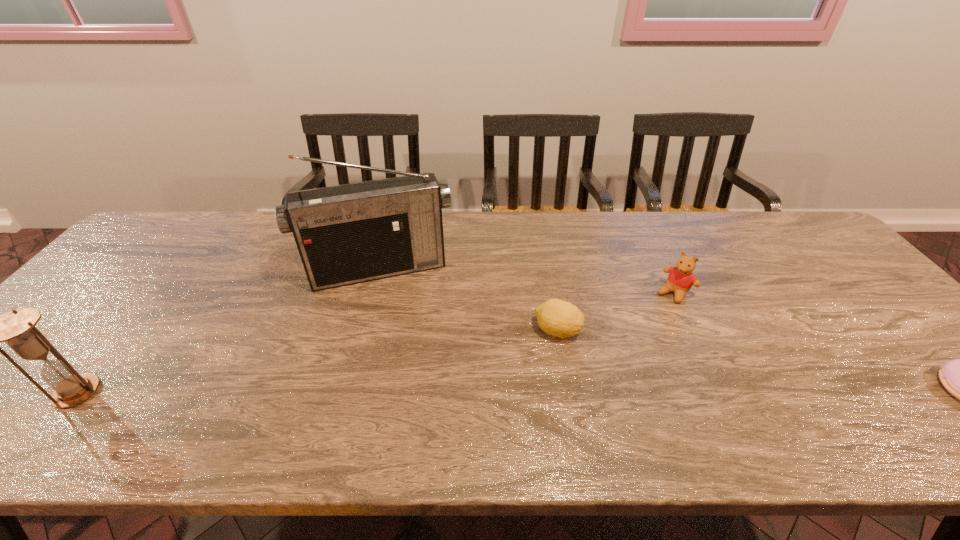
The height and width of the screenshot is (540, 960). Find the location of `the second tallest object`. the second tallest object is located at coordinates (17, 328).

What are the coordinates of `hourglass` in the screenshot? It's located at (17, 328).

Where is `teddy bear`? teddy bear is located at coordinates (680, 280).

The image size is (960, 540). What are the coordinates of `the third shortest object` in the screenshot? It's located at (680, 280).

At what (x,y) coordinates should I click in order to perform the action: click on the second shortest object. Please return your answer as a coordinate pair (x, y). The width and height of the screenshot is (960, 540). Looking at the image, I should click on (559, 318).

I want to click on the third object from left to right, so click(559, 318).

This screenshot has width=960, height=540. Identify the location of the fourth object from right to left. (346, 234).

Locate an element on the screen. the tallest object is located at coordinates (346, 234).

Where is `free space located 0.400m on the right of the second tallest object`? This screenshot has height=540, width=960. free space located 0.400m on the right of the second tallest object is located at coordinates (281, 392).

Where is `free region located on the front-facing side of the teddy bear`? free region located on the front-facing side of the teddy bear is located at coordinates (585, 392).